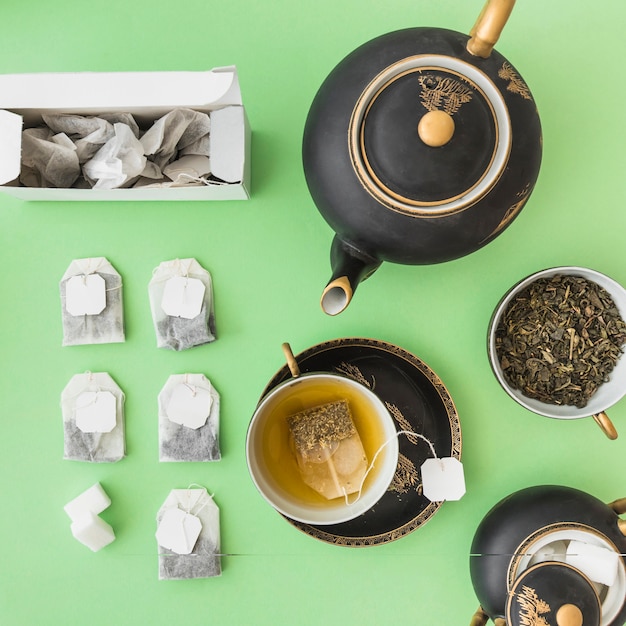
The height and width of the screenshot is (626, 626). What are the coordinates of `saucer` in the screenshot? It's located at (417, 393).